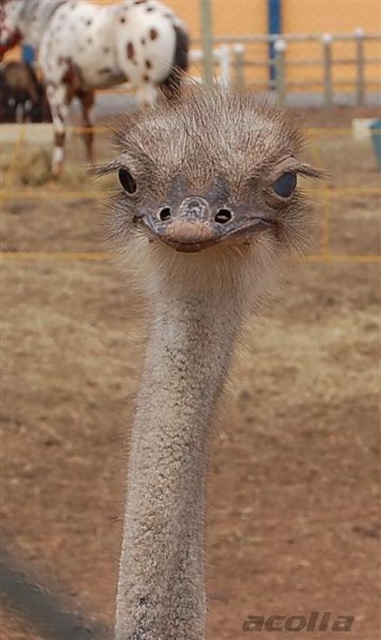
You are a zookeeper observing the gray feathered ostrich at center and the gray feathered ostrich head at upper center. Which part of the ostrich is positioned higher in the image?

The gray feathered ostrich head at upper center is positioned higher in the image than the gray feathered ostrich at center, which is located below it.